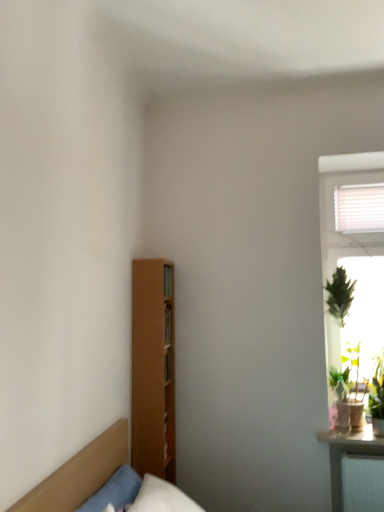
Question: From the image's perspective, is green leafy plant at right located above or below brown matte headboard at left?

Choices:
 (A) above
 (B) below

Answer: (B)

Question: Based on their positions, is green leafy plant at right located to the left or right of brown matte headboard at left?

Choices:
 (A) left
 (B) right

Answer: (B)

Question: Would you say green leafy plant at right is inside or outside brown matte headboard at left?

Choices:
 (A) outside
 (B) inside

Answer: (A)

Question: Is point (56, 494) positioned closer to the camera than point (357, 445)?

Choices:
 (A) farther
 (B) closer

Answer: (B)

Question: In terms of width, does brown matte headboard at left look wider or thinner when compared to green leafy plant at right?

Choices:
 (A) thin
 (B) wide

Answer: (A)

Question: Is brown matte headboard at left taller or shorter than green leafy plant at right?

Choices:
 (A) tall
 (B) short

Answer: (A)

Question: Considering their positions, is brown matte headboard at left located in front of or behind green leafy plant at right?

Choices:
 (A) behind
 (B) front

Answer: (B)